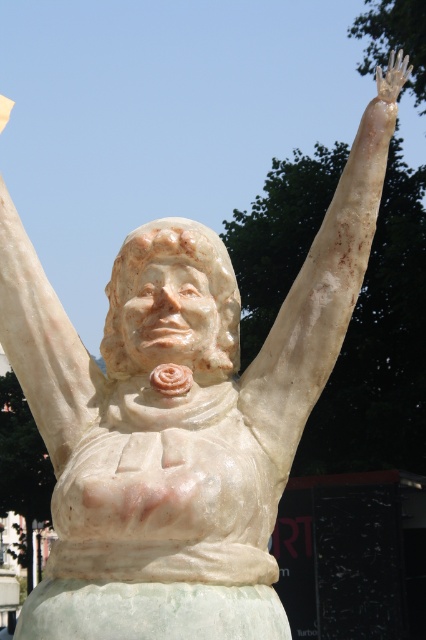
Question: Which of the following is the closest to the observer?

Choices:
 (A) pyautogui.click(x=14, y=262)
 (B) pyautogui.click(x=409, y=70)
 (C) pyautogui.click(x=264, y=429)

Answer: (C)

Question: Does white marble arm at upper right appear under white marble statue arm at upper center?

Choices:
 (A) no
 (B) yes

Answer: (A)

Question: Is white marble arm at upper right thinner than white marble hand at upper right?

Choices:
 (A) no
 (B) yes

Answer: (B)

Question: Does white marble arm at upper right have a greater width compared to white marble hand at upper right?

Choices:
 (A) yes
 (B) no

Answer: (B)

Question: Estimate the real-world distances between objects in this image. Which object is farther from the white marble hand at upper right?

Choices:
 (A) white marble statue arm at upper center
 (B) white marble arm at upper right

Answer: (B)

Question: Estimate the real-world distances between objects in this image. Which object is closer to the white marble statue arm at upper center?

Choices:
 (A) white marble hand at upper right
 (B) white marble arm at upper right

Answer: (B)